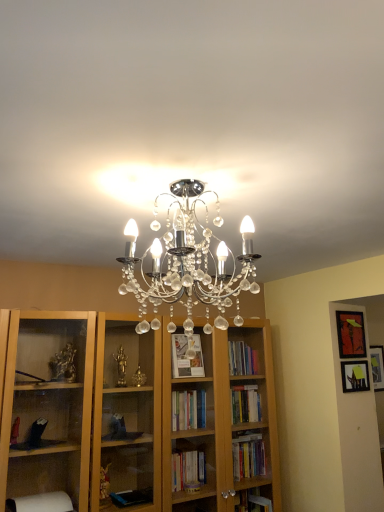
Question: Is matte black picture frame at upper right, arranged as the second picture frame when ordered from the bottom, situated inside matte black picture frame at upper right, the first picture frame in the bottom-to-top sequence, or outside?

Choices:
 (A) outside
 (B) inside

Answer: (A)

Question: From a real-world perspective, relative to matte black picture frame at upper right, placed as the 2th picture frame when sorted from top to bottom, is matte black picture frame at upper right, the 1th picture frame in the top-to-bottom sequence, vertically above or below?

Choices:
 (A) below
 (B) above

Answer: (B)

Question: Is matte black picture frame at upper right, arranged as the second picture frame when ordered from the bottom, bigger or smaller than matte black picture frame at upper right, the first picture frame in the bottom-to-top sequence?

Choices:
 (A) big
 (B) small

Answer: (A)

Question: Considering their positions, is matte black picture frame at upper right, the first picture frame in the bottom-to-top sequence, located in front of or behind matte black picture frame at upper right, the 1th picture frame in the top-to-bottom sequence?

Choices:
 (A) behind
 (B) front

Answer: (B)

Question: From a real-world perspective, relative to matte black picture frame at upper right, arranged as the second picture frame when ordered from the bottom, is matte black picture frame at upper right, placed as the 2th picture frame when sorted from top to bottom, vertically above or below?

Choices:
 (A) below
 (B) above

Answer: (A)

Question: Looking at the image, does matte black picture frame at upper right, placed as the 2th picture frame when sorted from top to bottom, seem bigger or smaller compared to matte black picture frame at upper right, arranged as the second picture frame when ordered from the bottom?

Choices:
 (A) big
 (B) small

Answer: (B)

Question: Is matte black picture frame at upper right, the first picture frame in the bottom-to-top sequence, taller or shorter than matte black picture frame at upper right, arranged as the second picture frame when ordered from the bottom?

Choices:
 (A) tall
 (B) short

Answer: (B)